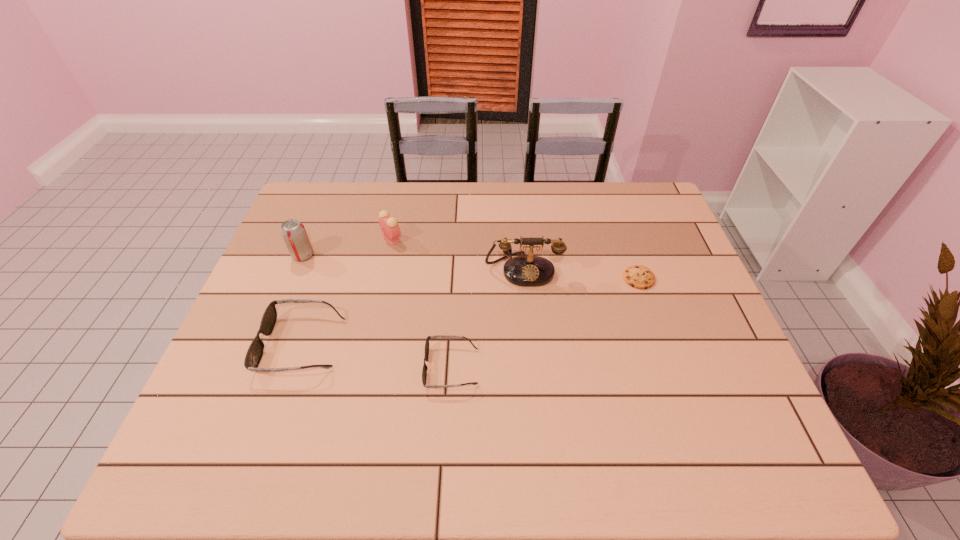
In order to click on object positioned at the right edge in this screenshot , I will do `click(640, 277)`.

Locate an element on the screen. free region at the far edge of the desktop is located at coordinates (459, 188).

Find the location of `vacant region at the near edge of the desktop`. vacant region at the near edge of the desktop is located at coordinates (438, 407).

Find the location of a particular element. free space at the left edge is located at coordinates (261, 359).

I want to click on vacant space at the right edge of the desktop, so click(x=675, y=244).

In the image, there is a desktop. Where is `vacant space at the far left corner`? The image size is (960, 540). vacant space at the far left corner is located at coordinates (348, 190).

In the image, there is a desktop. At what (x,y) coordinates should I click in order to perform the action: click on free space at the far right corner. Please return your answer as a coordinate pair (x, y). Image resolution: width=960 pixels, height=540 pixels. Looking at the image, I should click on (627, 199).

Locate an element on the screen. The height and width of the screenshot is (540, 960). free spot between the soda can and the cookie is located at coordinates [470, 267].

Identify the location of unoccupied area between the soda can and the fourth object from right to left. (348, 247).

Where is `free space between the third shortest object and the shortest object`? Image resolution: width=960 pixels, height=540 pixels. free space between the third shortest object and the shortest object is located at coordinates (470, 311).